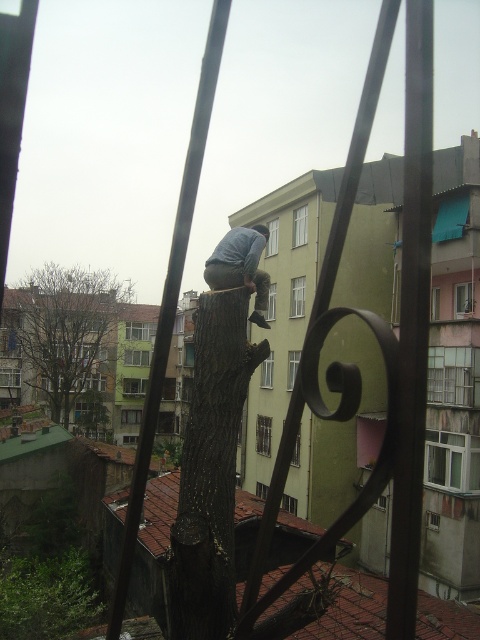
Is brown rough tree trunk at center further to camera compared to light blue denim jeans at center?

No, it is in front of light blue denim jeans at center.

Describe the element at coordinates (211, 470) in the screenshot. The image size is (480, 640). I see `brown rough tree trunk at center` at that location.

Locate an element on the screen. The image size is (480, 640). brown rough tree trunk at center is located at coordinates (211, 470).

Can you confirm if brown leafless tree at lower left is positioned to the right of light blue denim jeans at center?

No, brown leafless tree at lower left is not to the right of light blue denim jeans at center.

Can you confirm if brown leafless tree at lower left is positioned above light blue denim jeans at center?

Yes, brown leafless tree at lower left is above light blue denim jeans at center.

I want to click on brown leafless tree at lower left, so click(x=66, y=332).

Who is taller, brown rough tree trunk at center or brown leafless tree at lower left?

Standing taller between the two is brown leafless tree at lower left.

Is the position of brown rough tree trunk at center more distant than that of brown leafless tree at lower left?

No, it is in front of brown leafless tree at lower left.

This screenshot has height=640, width=480. What do you see at coordinates (211, 470) in the screenshot? I see `brown rough tree trunk at center` at bounding box center [211, 470].

Where is `brown rough tree trunk at center`? This screenshot has height=640, width=480. brown rough tree trunk at center is located at coordinates pyautogui.click(x=211, y=470).